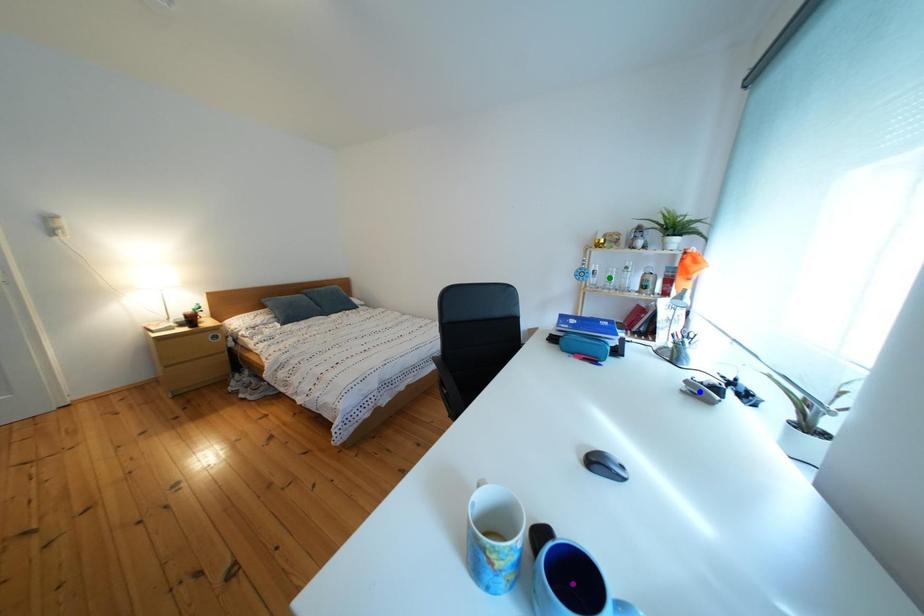
Order these from nearest to farthest:
1. green point
2. blue point
3. purple point

green point < blue point < purple point